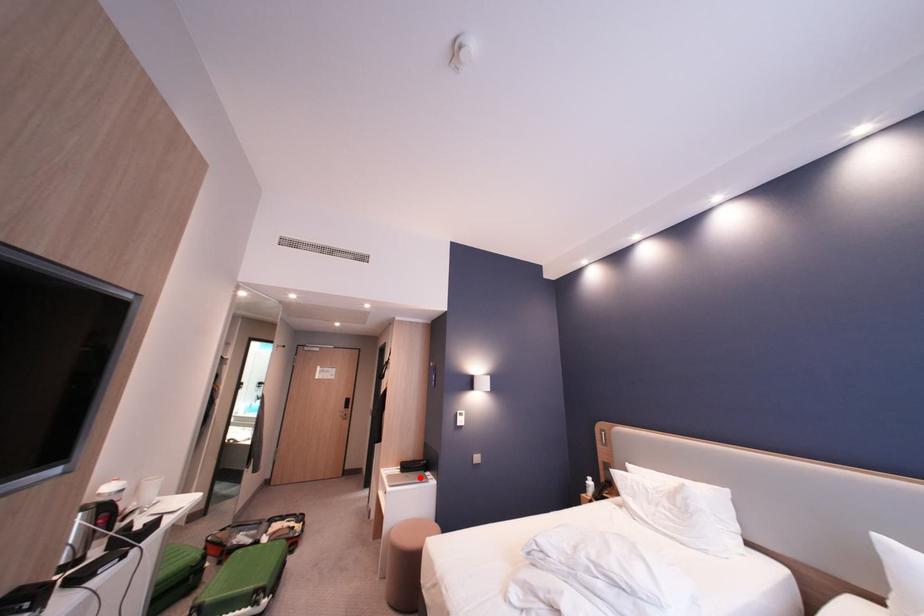
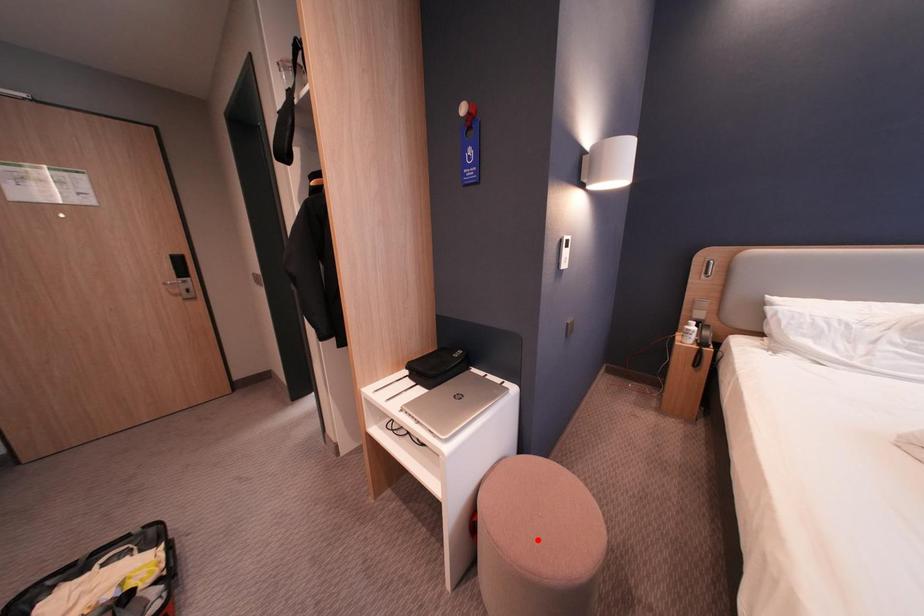
I am providing you with two images of the same scene from different viewpoints. A red point is marked on the first image and another point is marked on the second image. Does the point marked in image1 correspond to the same location as the one in image2?

No